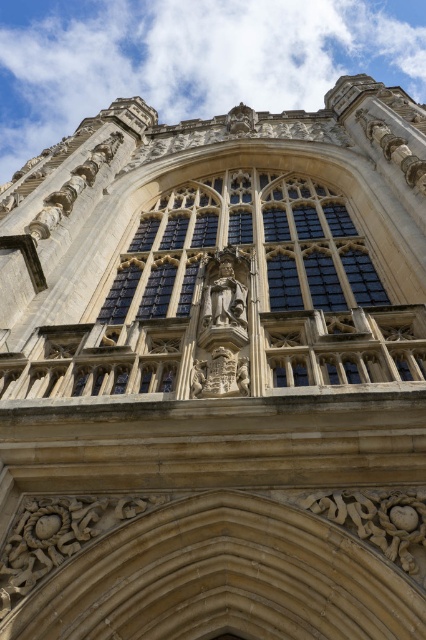
You are an architect examining the cathedral design. You notice the dark glass window at center and the matte stone statue at center. Which object is positioned closer to the front of the structure?

The dark glass window at center is closer to the front of the structure because the matte stone statue at center is behind it.

You are an architect examining the cathedral design. You need to determine the spatial relationship between the dark glass window at center and the matte stone statue at center. Which object is located above the other?

The dark glass window at center is positioned over the matte stone statue at center, meaning the window is above the statue.